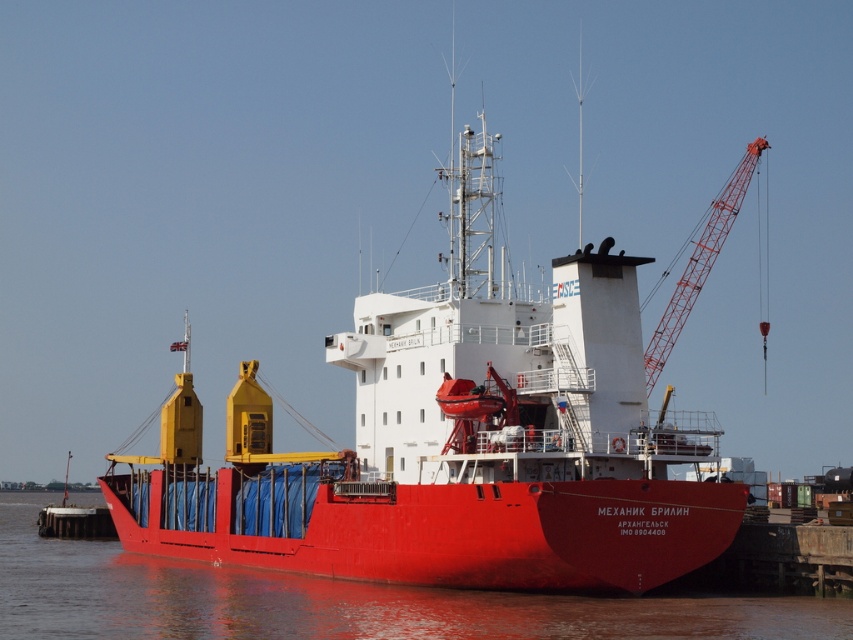
Question: Can you confirm if shiny red ship at center is thinner than glossy water at ship center?

Choices:
 (A) no
 (B) yes

Answer: (B)

Question: Which of the following is the farthest from the observer?

Choices:
 (A) (465, 618)
 (B) (695, 264)
 (C) (527, 588)

Answer: (B)

Question: Considering the real-world distances, which object is farthest from the glossy water at ship center?

Choices:
 (A) red metal crane at upper right
 (B) shiny red ship at center

Answer: (A)

Question: Can you confirm if shiny red ship at center is positioned below glossy water at ship center?

Choices:
 (A) yes
 (B) no

Answer: (B)

Question: Which of the following is the closest to the observer?

Choices:
 (A) glossy water at ship center
 (B) red metal crane at upper right
 (C) shiny red ship at center

Answer: (A)

Question: Is shiny red ship at center smaller than glossy water at ship center?

Choices:
 (A) no
 (B) yes

Answer: (A)